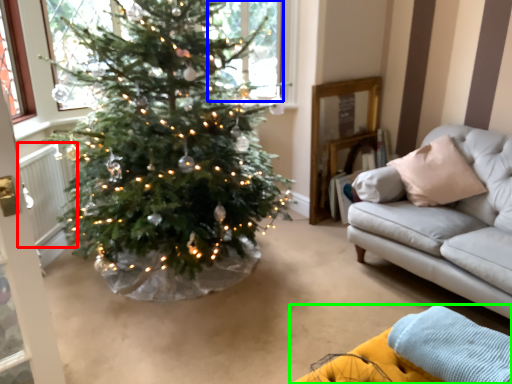
Question: Estimate the real-world distances between objects in this image. Which object is farther from radiator (highlighted by a red box), window (highlighted by a blue box) or couch (highlighted by a green box)?

Choices:
 (A) window
 (B) couch

Answer: (B)